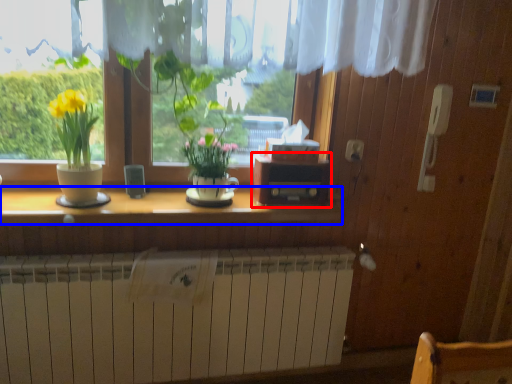
Question: Which of the following is the closest to the observer, window box (highlighted by a red box) or counter top (highlighted by a blue box)?

Choices:
 (A) window box
 (B) counter top

Answer: (B)